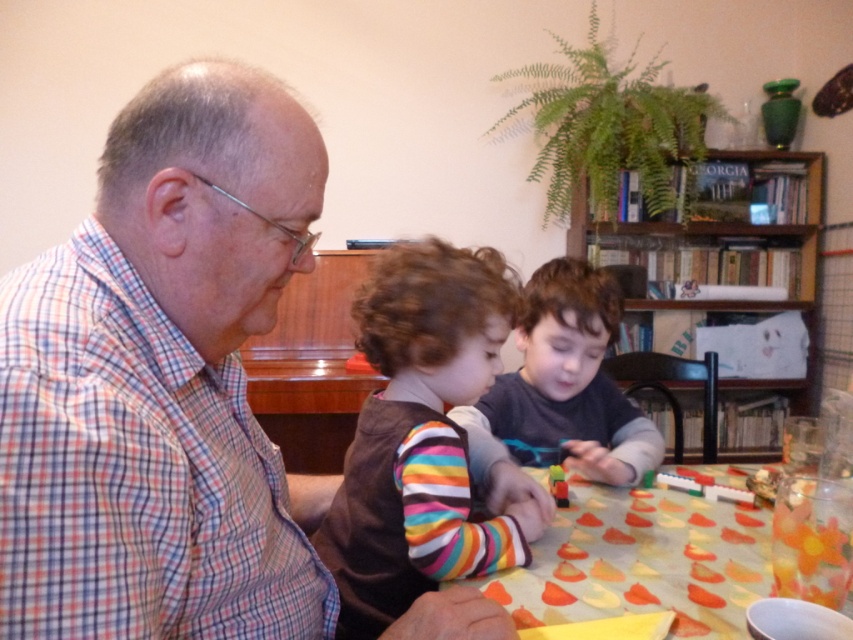
Question: In this image, where is brown fabric shirt at center located relative to yellow paper at center?

Choices:
 (A) right
 (B) left

Answer: (B)

Question: Where is yellow paper at center located in relation to dark gray sweater at center in the image?

Choices:
 (A) above
 (B) below

Answer: (B)

Question: Which point is farther from the camera taking this photo?

Choices:
 (A) (544, 337)
 (B) (418, 387)
 (C) (515, 582)

Answer: (A)

Question: Can you confirm if yellow paper at center is wider than dark gray sweater at center?

Choices:
 (A) no
 (B) yes

Answer: (B)

Question: Among these points, which one is nearest to the camera?

Choices:
 (A) pyautogui.click(x=465, y=330)
 (B) pyautogui.click(x=607, y=413)

Answer: (A)

Question: Which point appears closest to the camera in this image?

Choices:
 (A) (689, 497)
 (B) (344, 528)
 (C) (601, 324)

Answer: (B)